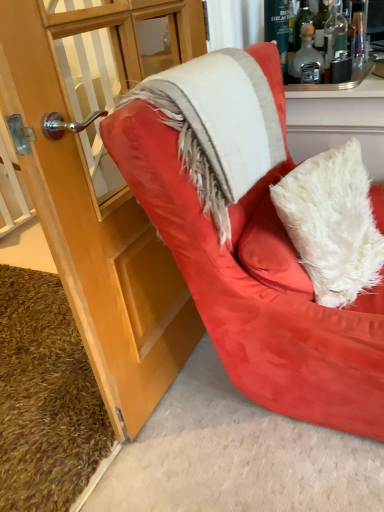
Question: Can you confirm if white fuzzy blanket at upper right is thinner than brown shaggy carpet at lower left?

Choices:
 (A) no
 (B) yes

Answer: (B)

Question: Is the position of white fuzzy blanket at upper right more distant than that of brown shaggy carpet at lower left?

Choices:
 (A) no
 (B) yes

Answer: (A)

Question: Considering the relative positions of white fuzzy blanket at upper right and brown shaggy carpet at lower left in the image provided, is white fuzzy blanket at upper right in front of brown shaggy carpet at lower left?

Choices:
 (A) yes
 (B) no

Answer: (A)

Question: Does white fuzzy blanket at upper right have a lesser height compared to brown shaggy carpet at lower left?

Choices:
 (A) no
 (B) yes

Answer: (A)

Question: Does white fuzzy blanket at upper right have a larger size compared to brown shaggy carpet at lower left?

Choices:
 (A) yes
 (B) no

Answer: (B)

Question: From a real-world perspective, relative to matte wood cabinet at left, is translucent glass bottle at upper right, the 1th bottle when ordered from right to left, vertically above or below?

Choices:
 (A) below
 (B) above

Answer: (B)

Question: Considering the positions of translucent glass bottle at upper right, the 1th bottle when ordered from right to left, and matte wood cabinet at left in the image, is translucent glass bottle at upper right, the 1th bottle when ordered from right to left, taller or shorter than matte wood cabinet at left?

Choices:
 (A) tall
 (B) short

Answer: (B)

Question: Is translucent glass bottle at upper right, which is the 2th bottle in left-to-right order, inside or outside of matte wood cabinet at left?

Choices:
 (A) outside
 (B) inside

Answer: (A)

Question: From the image's perspective, is translucent glass bottle at upper right, the 1th bottle when ordered from right to left, positioned above or below matte wood cabinet at left?

Choices:
 (A) above
 (B) below

Answer: (A)

Question: Considering the positions of brown shaggy carpet at lower left and translucent glass bottle at upper right, which is the 2th bottle in left-to-right order, in the image, is brown shaggy carpet at lower left taller or shorter than translucent glass bottle at upper right, which is the 2th bottle in left-to-right order,?

Choices:
 (A) tall
 (B) short

Answer: (B)

Question: Is brown shaggy carpet at lower left bigger or smaller than translucent glass bottle at upper right, which is the 2th bottle in left-to-right order?

Choices:
 (A) small
 (B) big

Answer: (B)

Question: Considering the positions of point (34, 313) and point (332, 7), is point (34, 313) closer or farther from the camera than point (332, 7)?

Choices:
 (A) closer
 (B) farther

Answer: (B)

Question: Is brown shaggy carpet at lower left wider or thinner than translucent glass bottle at upper right, the 1th bottle when ordered from right to left?

Choices:
 (A) wide
 (B) thin

Answer: (A)

Question: Is point (218, 97) closer or farther from the camera than point (301, 58)?

Choices:
 (A) farther
 (B) closer

Answer: (B)

Question: From a real-world perspective, is white fuzzy blanket at upper right physically located above or below translucent glass bottle at upper right, marked as the 1th bottle in a left-to-right arrangement?

Choices:
 (A) above
 (B) below

Answer: (B)